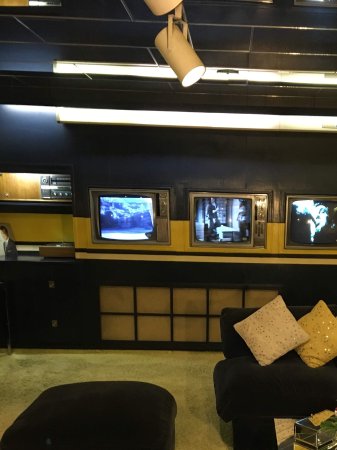
The image size is (337, 450). Find the location of `couch`. couch is located at coordinates (275, 382).